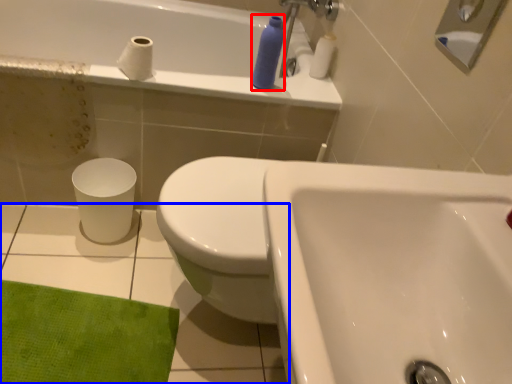
Question: Which object is further to the camera taking this photo, toiletry (highlighted by a red box) or ceramic tile (highlighted by a blue box)?

Choices:
 (A) toiletry
 (B) ceramic tile

Answer: (A)